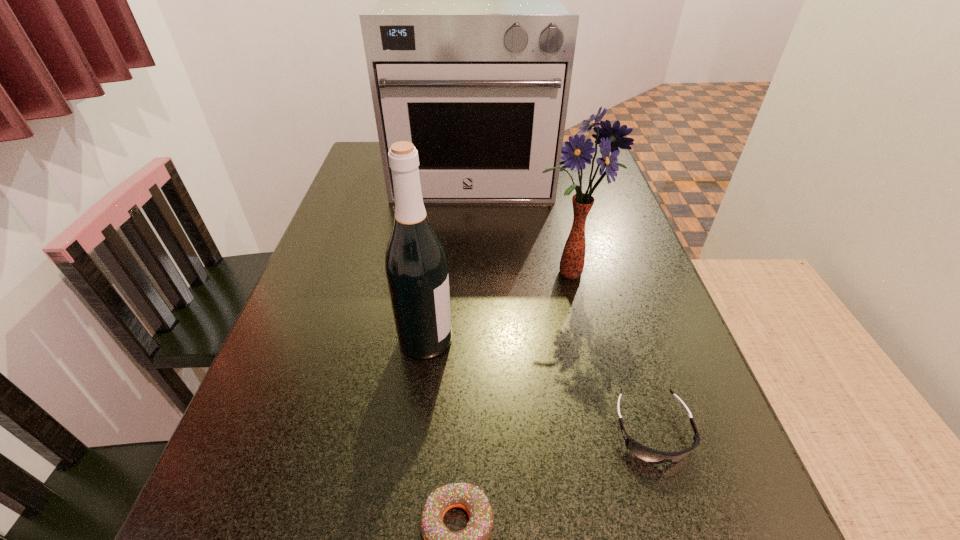
The width and height of the screenshot is (960, 540). Identify the location of object that is the fourth closest to the second farthest object. (438, 539).

At what (x,y) coordinates should I click in order to perform the action: click on object that stands as the fourth closest to the toaster oven. Please return your answer as a coordinate pair (x, y). This screenshot has width=960, height=540. Looking at the image, I should click on coord(438,539).

The height and width of the screenshot is (540, 960). What are the coordinates of `vacant area in the image that satisfies the following two spatial constraints: 1. on the front panel of the toaster oven; 2. on the label of the third farthest object` in the screenshot? It's located at (468, 340).

The width and height of the screenshot is (960, 540). I want to click on blank space that satisfies the following two spatial constraints: 1. on the front panel of the flower arrangement; 2. on the right side of the farthest object, so click(x=470, y=274).

Find the location of `free space that satisfies the following two spatial constraints: 1. on the front panel of the farthest object; 2. on the label of the third nearest object`. free space that satisfies the following two spatial constraints: 1. on the front panel of the farthest object; 2. on the label of the third nearest object is located at coordinates (468, 340).

Image resolution: width=960 pixels, height=540 pixels. Find the location of `vacant space that satisfies the following two spatial constraints: 1. on the front side of the flower arrangement; 2. on the label of the third nearest object`. vacant space that satisfies the following two spatial constraints: 1. on the front side of the flower arrangement; 2. on the label of the third nearest object is located at coordinates (583, 340).